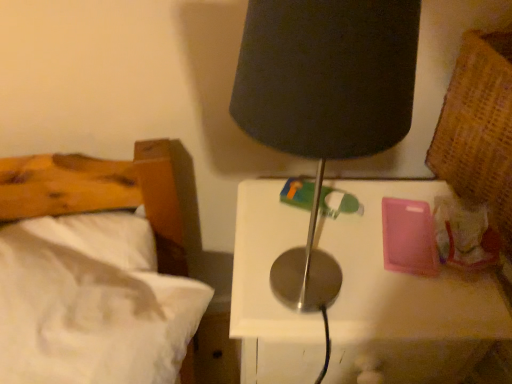
Find the location of `free point above metallic white nightstand at center (from a real-world perspective)`. free point above metallic white nightstand at center (from a real-world perspective) is located at coordinates (354, 244).